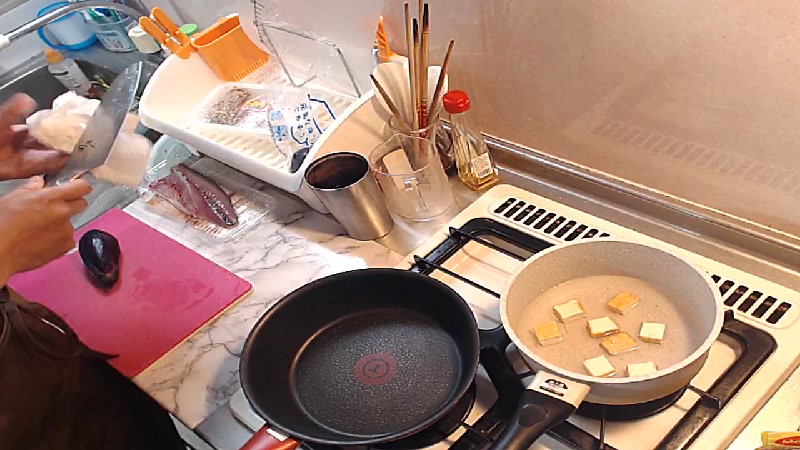
Where is `pink mat`? pink mat is located at coordinates (173, 304).